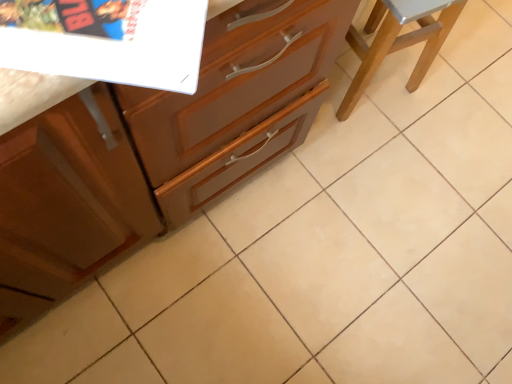
Question: Is wooden cabinet at center not near wooden stool at right?

Choices:
 (A) no
 (B) yes

Answer: (A)

Question: Is wooden cabinet at center directly adjacent to wooden stool at right?

Choices:
 (A) no
 (B) yes

Answer: (A)

Question: Considering the relative sizes of wooden cabinet at center and wooden stool at right in the image provided, is wooden cabinet at center thinner than wooden stool at right?

Choices:
 (A) no
 (B) yes

Answer: (A)

Question: Is wooden cabinet at center shorter than wooden stool at right?

Choices:
 (A) yes
 (B) no

Answer: (A)

Question: Is wooden cabinet at center at the left side of wooden stool at right?

Choices:
 (A) yes
 (B) no

Answer: (A)

Question: Does wooden cabinet at center have a larger size compared to wooden stool at right?

Choices:
 (A) yes
 (B) no

Answer: (A)

Question: From the image's perspective, would you say wooden stool at right is positioned over wooden cabinet at center?

Choices:
 (A) no
 (B) yes

Answer: (B)

Question: From a real-world perspective, is wooden stool at right under wooden cabinet at center?

Choices:
 (A) yes
 (B) no

Answer: (B)

Question: Can you confirm if wooden stool at right is taller than wooden cabinet at center?

Choices:
 (A) no
 (B) yes

Answer: (B)

Question: Is wooden stool at right positioned with its back to wooden cabinet at center?

Choices:
 (A) yes
 (B) no

Answer: (B)

Question: Considering the relative positions of wooden stool at right and wooden cabinet at center in the image provided, is wooden stool at right in front of wooden cabinet at center?

Choices:
 (A) no
 (B) yes

Answer: (A)

Question: From the image's perspective, does wooden stool at right appear lower than wooden cabinet at center?

Choices:
 (A) no
 (B) yes

Answer: (A)

Question: Relative to wooden stool at right, is wooden cabinet at center in front or behind?

Choices:
 (A) front
 (B) behind

Answer: (A)